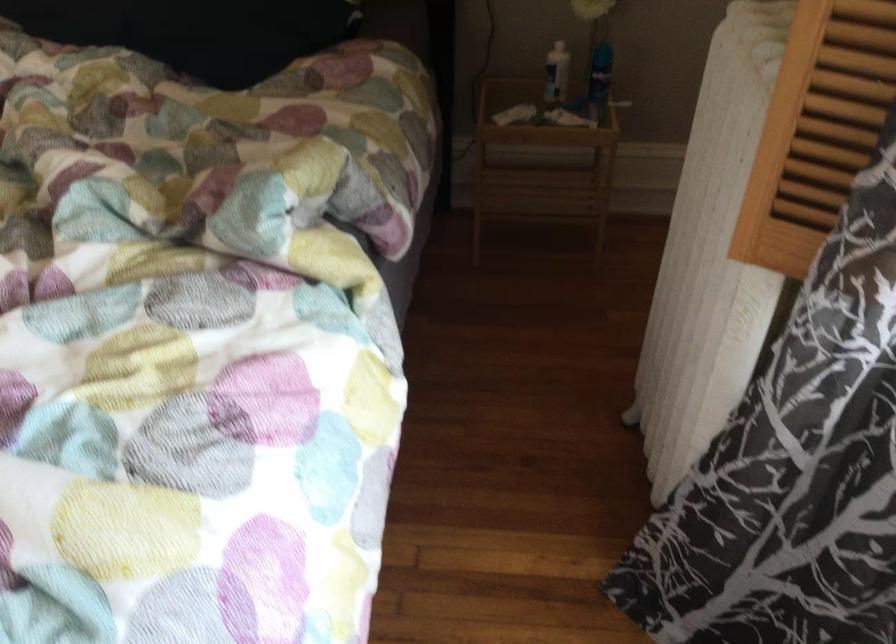
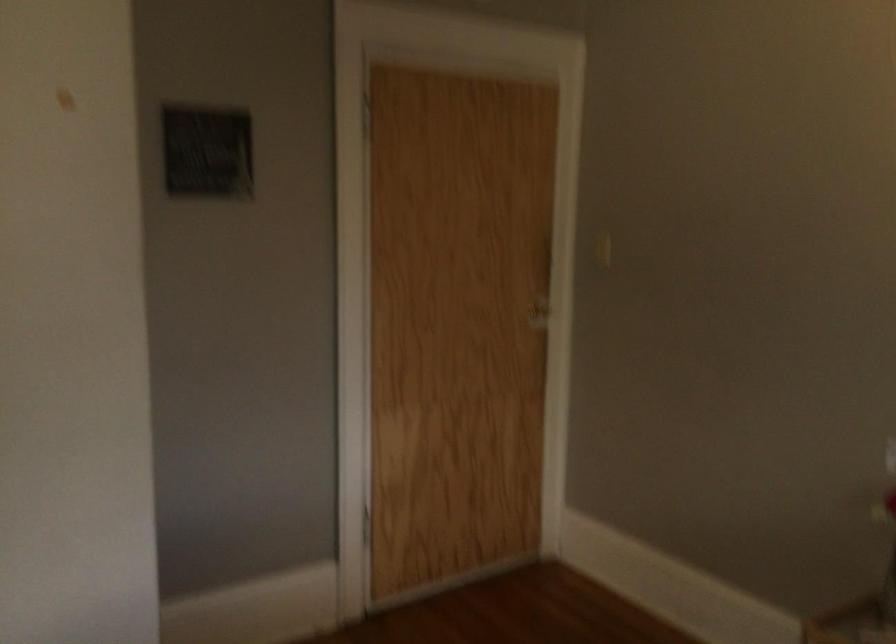
Question: How did the camera likely rotate?

Choices:
 (A) Left
 (B) Right
 (C) Up
 (D) Down

Answer: (A)